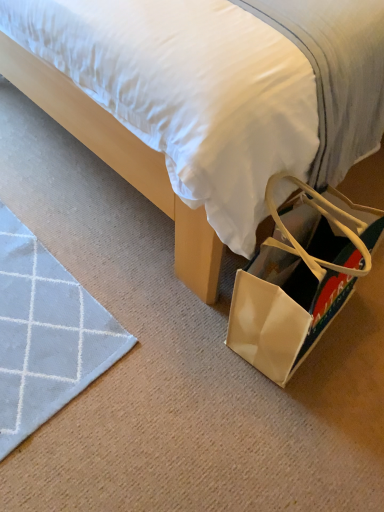
Question: From the image's perspective, relative to white fabric bed at center, is matte beige shoulder bag at lower right above or below?

Choices:
 (A) below
 (B) above

Answer: (A)

Question: Is point [364, 207] closer or farther from the camera than point [130, 84]?

Choices:
 (A) farther
 (B) closer

Answer: (A)

Question: Is matte beige shoulder bag at lower right in front of or behind white fabric bed at center in the image?

Choices:
 (A) front
 (B) behind

Answer: (B)

Question: Considering the positions of point (x=205, y=182) and point (x=365, y=248), is point (x=205, y=182) closer or farther from the camera than point (x=365, y=248)?

Choices:
 (A) farther
 (B) closer

Answer: (B)

Question: From a real-world perspective, relative to matte beige shoulder bag at lower right, is white fabric bed at center vertically above or below?

Choices:
 (A) above
 (B) below

Answer: (A)

Question: Relative to matte beige shoulder bag at lower right, is white fabric bed at center in front or behind?

Choices:
 (A) front
 (B) behind

Answer: (A)

Question: Based on their sizes in the image, would you say white fabric bed at center is bigger or smaller than matte beige shoulder bag at lower right?

Choices:
 (A) big
 (B) small

Answer: (A)